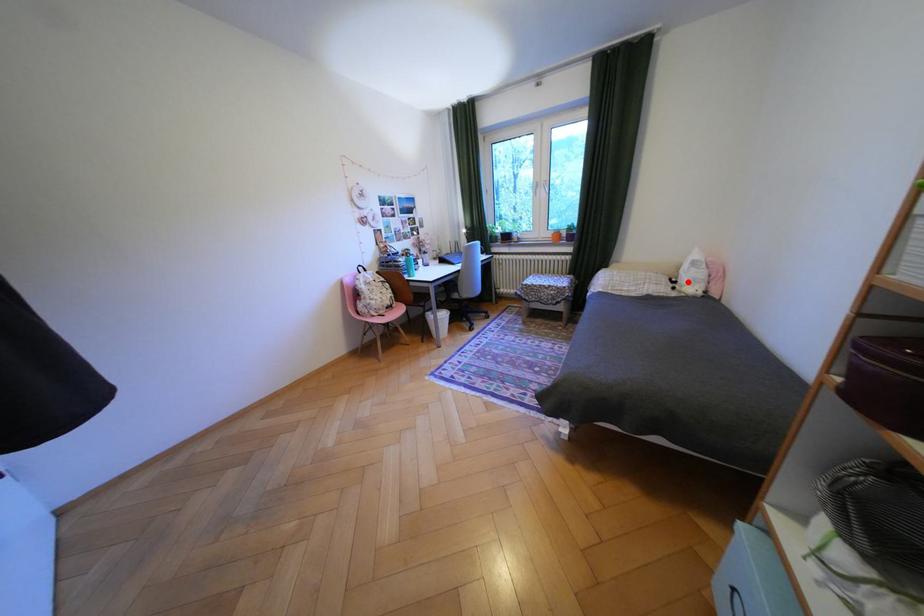
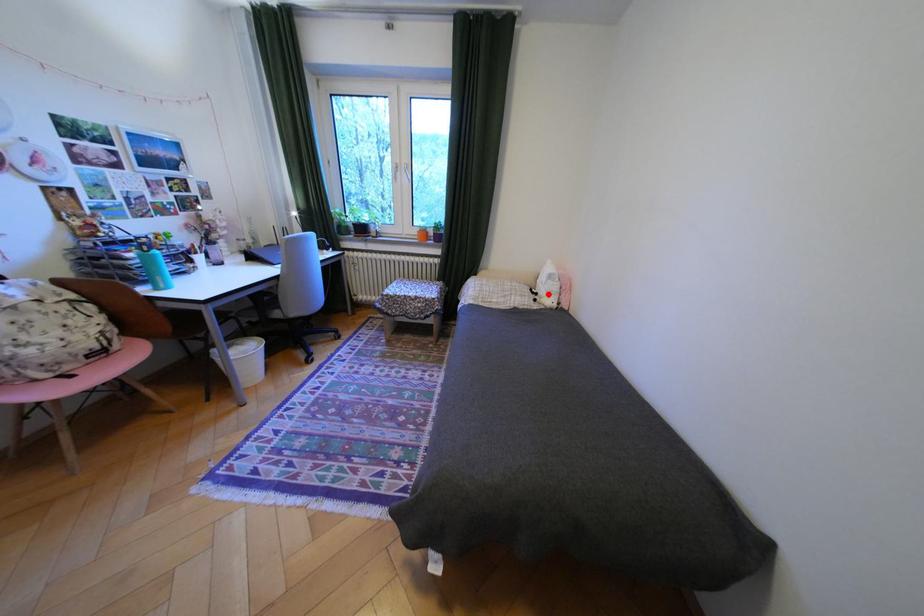
I am providing you with two images of the same scene from different viewpoints. A red point is marked on the first image and another point is marked on the second image. Is the marked point in image1 the same physical position as the marked point in image2?

Yes